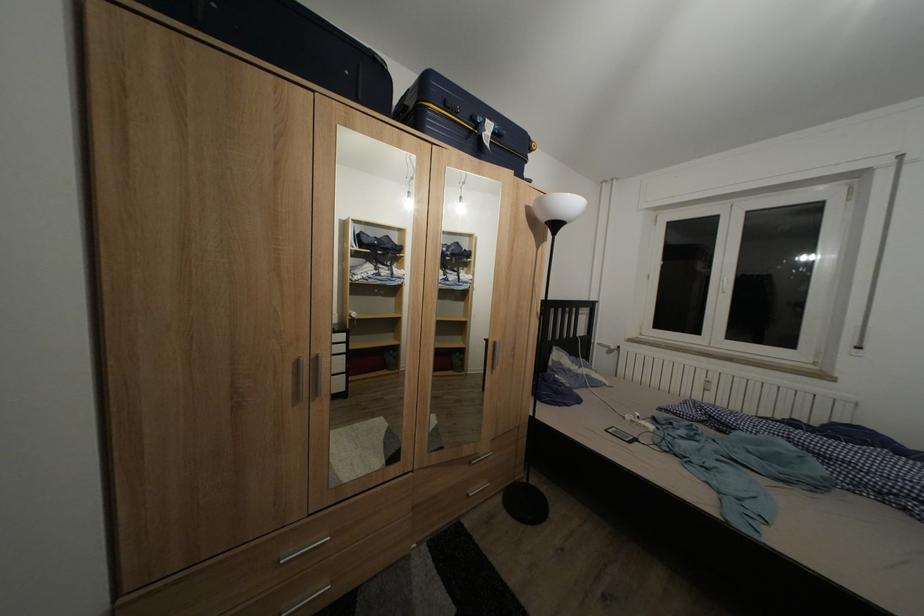
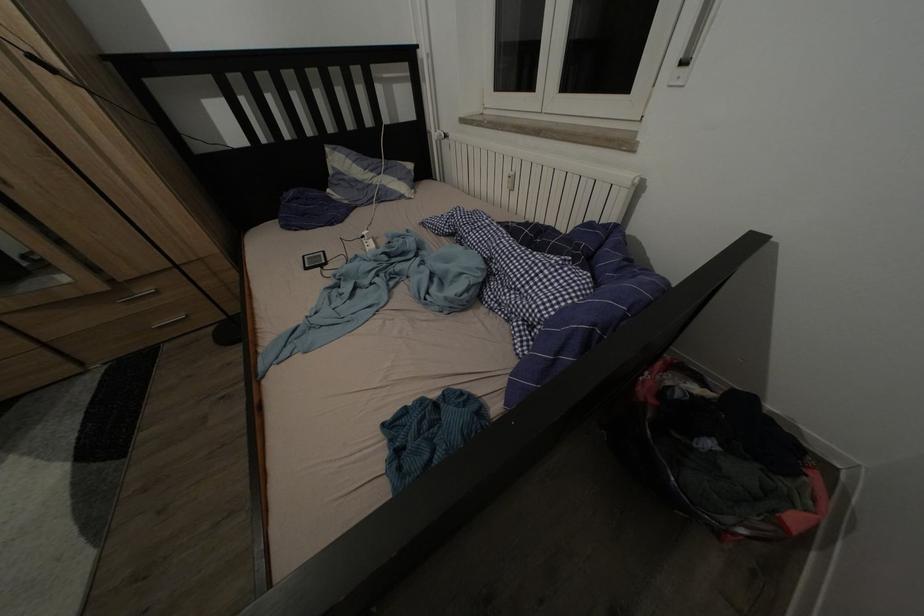
In the second image, find the point that corresponds to the point at 646,419 in the first image.

(372, 238)